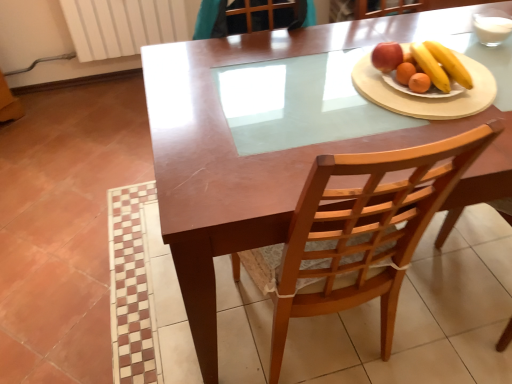
Locate an element on the screen. This screenshot has width=512, height=384. free space to the left of smooth wooden plate with fruits at right is located at coordinates (342, 88).